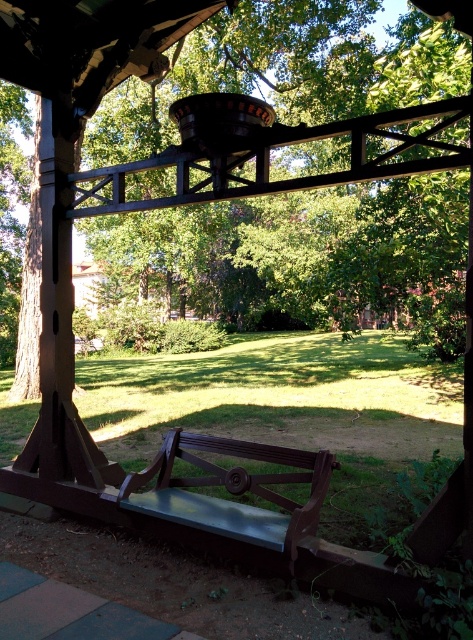
Question: Is brown wood tree at upper left below metallic polished bench at center?

Choices:
 (A) yes
 (B) no

Answer: (B)

Question: Which point is farther to the camera?

Choices:
 (A) (93, 51)
 (B) (288, 520)

Answer: (A)

Question: Where is brown wood tree at upper left located in relation to metallic polished bench at center in the image?

Choices:
 (A) below
 (B) above

Answer: (B)

Question: Is brown wood tree at upper left behind metallic polished bench at center?

Choices:
 (A) yes
 (B) no

Answer: (B)

Question: Which point is closer to the camera taking this photo?

Choices:
 (A) (23, 369)
 (B) (177, 429)

Answer: (B)